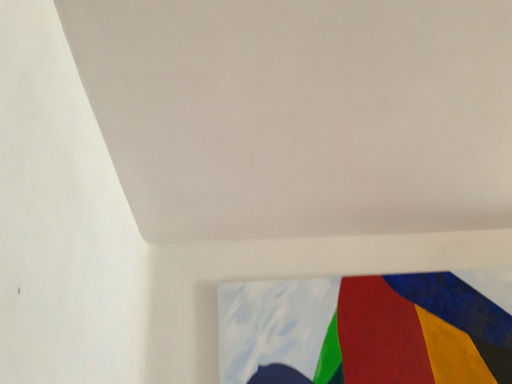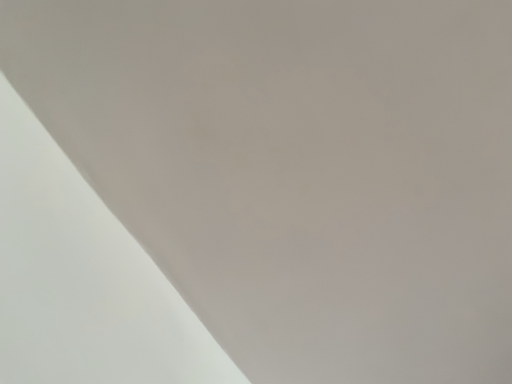
Question: How did the camera likely rotate when shooting the video?

Choices:
 (A) rotated left
 (B) rotated right

Answer: (A)